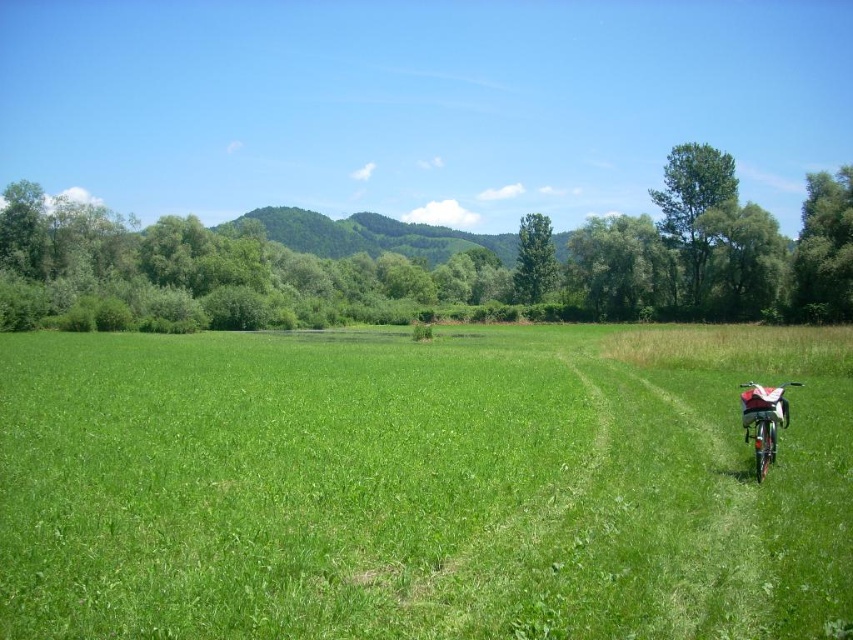
You are standing at the edge of the green grassy field at center and want to ride your metallic silver bicycle at lower right to the far end. Since the field is wider than the bicycle, can you safely ride straight without touching the edges?

The green grassy field at center is wider than the metallic silver bicycle at lower right, so yes, you can safely ride straight without touching the edges.

You are standing at the point with coordinates point (770, 449) and want to walk to the point with coordinates point (309, 358). Which direction should you move in to reach your destination?

You should move forward because point (309, 358) is behind point (770, 449), meaning it is in the direction you are facing.

You are planning to take a photo of the green grassy field at center and the metallic silver bicycle at lower right. Which object will occupy more space in your photo?

The green grassy field at center will occupy more space in the photo because it is larger in size than the metallic silver bicycle at lower right.